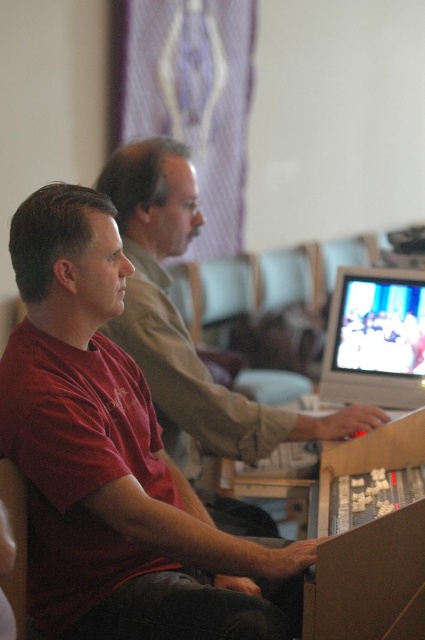
Question: Which of the following is the closest to the observer?

Choices:
 (A) (201, 216)
 (B) (390, 304)

Answer: (A)

Question: Observing the image, what is the correct spatial positioning of matte red shirt at center in reference to matte plastic monitor at center right?

Choices:
 (A) right
 (B) left

Answer: (B)

Question: Does matte red shirt at center have a larger size compared to matte plastic monitor at center right?

Choices:
 (A) no
 (B) yes

Answer: (B)

Question: Can you confirm if matte red shirt at center is positioned to the left of matte plastic monitor at center right?

Choices:
 (A) yes
 (B) no

Answer: (A)

Question: Among these points, which one is nearest to the camera?

Choices:
 (A) pyautogui.click(x=385, y=358)
 (B) pyautogui.click(x=149, y=371)

Answer: (B)

Question: Among these points, which one is farthest from the camera?

Choices:
 (A) (187, 406)
 (B) (348, 323)

Answer: (B)